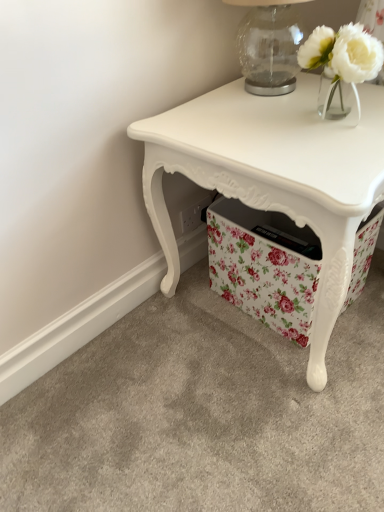
At what (x,y) coordinates should I click in order to perform the action: click on vacant space to the left of white glass vase at upper right. Please return your answer as a coordinate pair (x, y). Image resolution: width=384 pixels, height=512 pixels. Looking at the image, I should click on (264, 123).